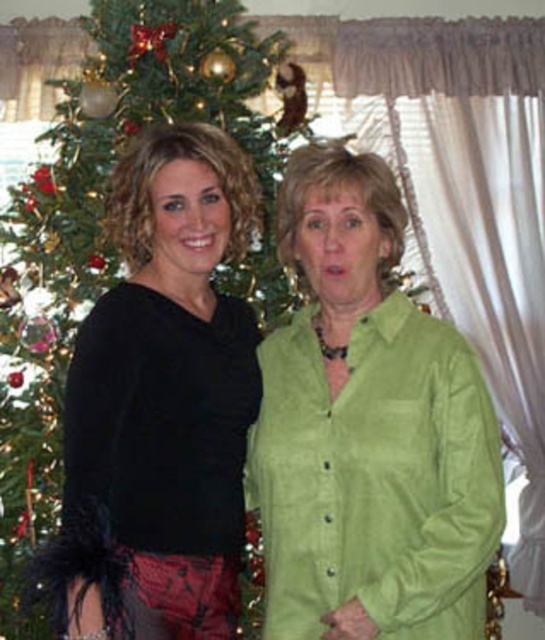
You are standing in front of the Christmas tree and want to place a gift at the position marked by point (x=305, y=323) and another gift at point (x=202, y=416). Which gift will be closer to the camera?

The gift placed at point (x=202, y=416) will be closer to the camera because point (x=305, y=323) is behind point (x=202, y=416).

You are a fashion designer who needs to place a green suede blouse at center and a black satin blouse at left on a mannequin. The mannequin has a 10 inch wide shelf. Can both blouses fit side by side on the shelf?

The green suede blouse at center is 9.17 inches from the black satin blouse at left, so yes, both blouses can fit side by side on the 10 inch wide shelf since the total width required is less than the shelf width.